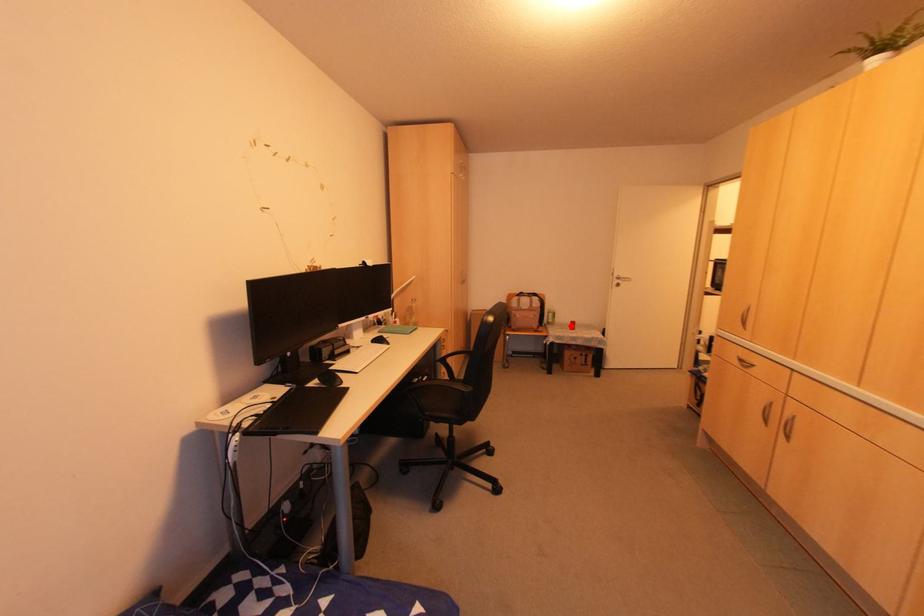
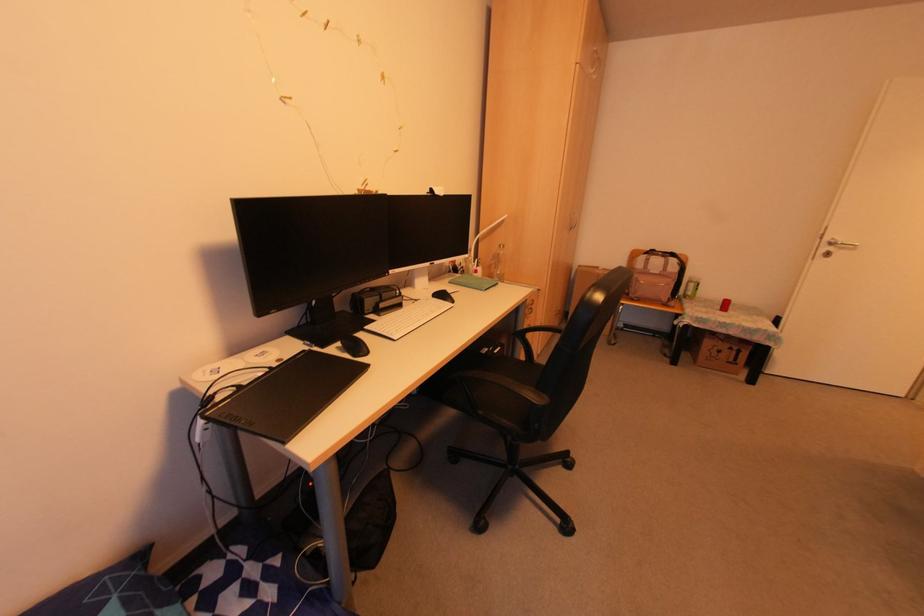
Where in the second image is the point corresponding to the highlighted location from the first image?

(723, 306)